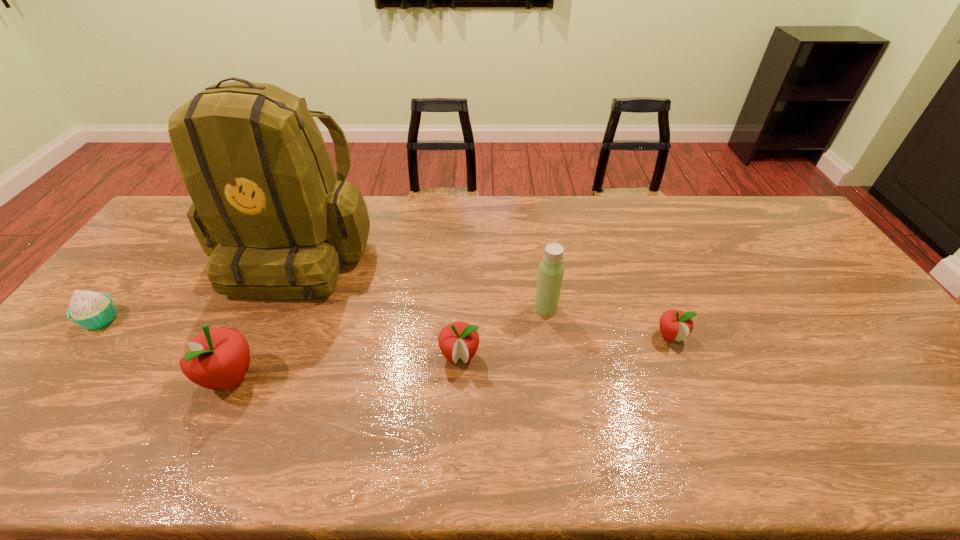
The height and width of the screenshot is (540, 960). What are the coordinates of `the tallest apple` in the screenshot? It's located at (220, 357).

The image size is (960, 540). I want to click on the third tallest object, so click(220, 357).

The image size is (960, 540). I want to click on the third object from right to left, so click(456, 340).

Locate an element on the screen. the second apple from right to left is located at coordinates (456, 340).

Find the location of `the shortest apple`. the shortest apple is located at coordinates (674, 324).

The height and width of the screenshot is (540, 960). In order to click on the rightmost apple in this screenshot , I will do `click(674, 324)`.

Where is `the leftmost object`? the leftmost object is located at coordinates (91, 310).

Locate an element on the screen. backpack is located at coordinates (267, 209).

Identify the location of the second object from right to left. (551, 269).

Identify the location of thermos bottle. This screenshot has width=960, height=540. 551,269.